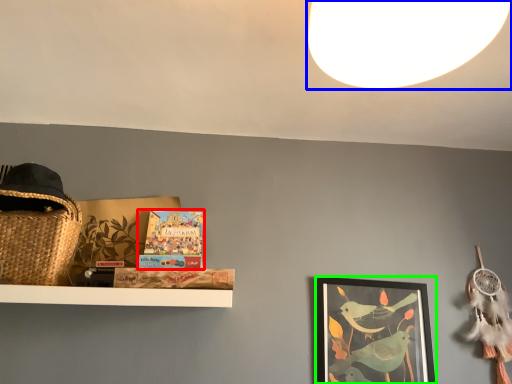
Question: Which object is the closest to the book (highlighted by a red box)? Choose among these: light (highlighted by a blue box) or picture frame (highlighted by a green box).

Choices:
 (A) light
 (B) picture frame

Answer: (B)